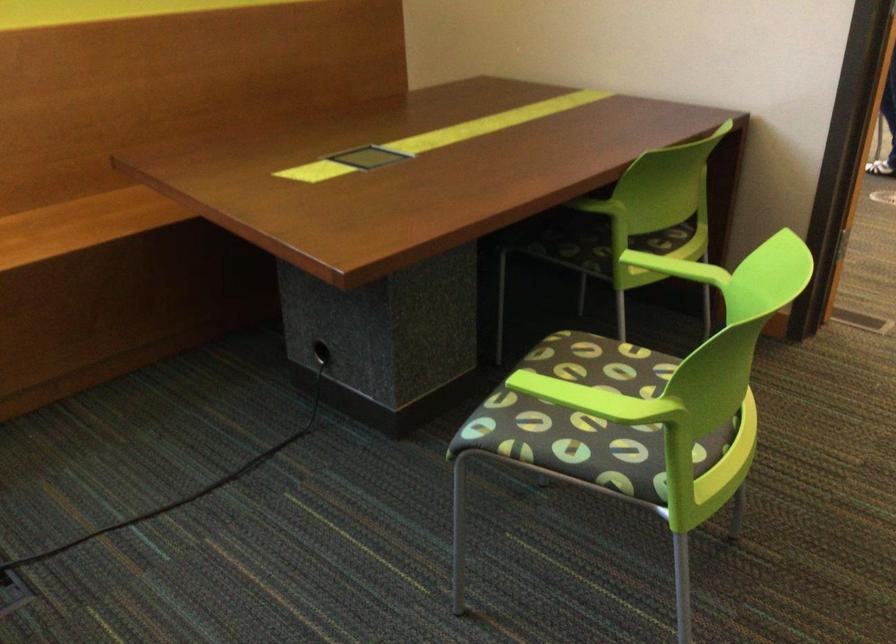
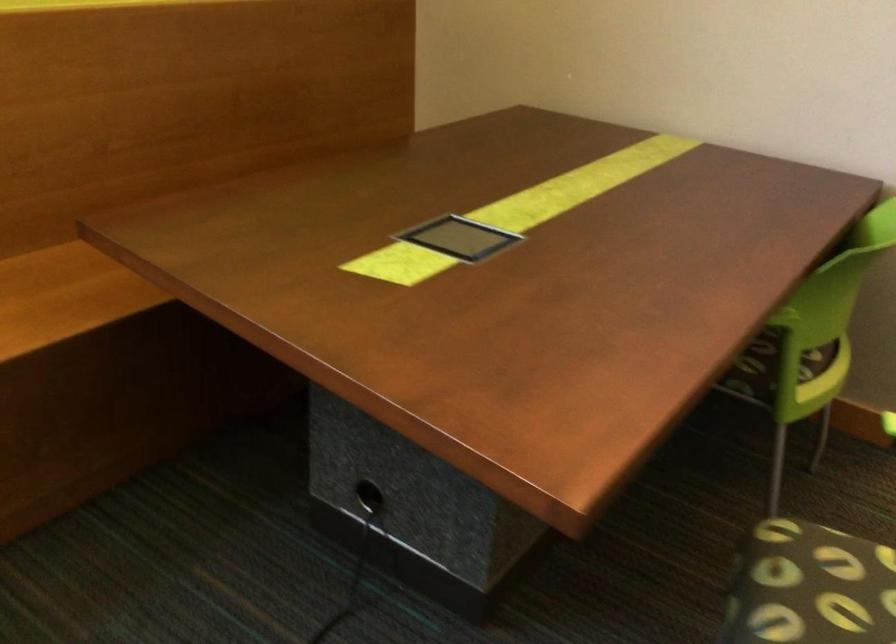
Question: The images are taken continuously from a first-person perspective. In which direction is your viewpoint rotating?

Choices:
 (A) Left
 (B) Right
 (C) Up
 (D) Down

Answer: (B)